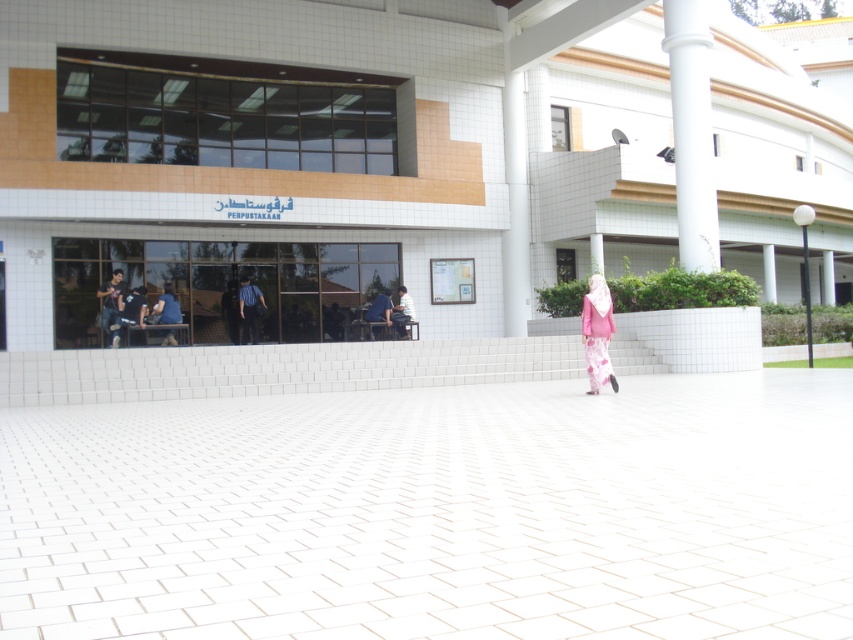
Which is behind, point (686, 92) or point (384, 312)?

The point (384, 312) is more distant.

This screenshot has width=853, height=640. In order to click on white smooth column at right in this screenshot , I will do `click(691, 132)`.

Is point (682, 266) positioned behind point (386, 320)?

No, (682, 266) is closer to viewer.

Where is `white smooth column at right`? The image size is (853, 640). white smooth column at right is located at coordinates (691, 132).

Who is taller, white tile pavement at center or matte black shirt at center?

With more height is matte black shirt at center.

Where is `white tile pavement at center`? The image size is (853, 640). white tile pavement at center is located at coordinates (437, 513).

Which is more to the left, white tile pavement at center or pink satin hijab at center?

white tile pavement at center

Is white tile pavement at center thinner than pink satin hijab at center?

No, white tile pavement at center is not thinner than pink satin hijab at center.

Which is behind, point (161, 586) or point (601, 342)?

The point (601, 342) is more distant.

Identify the location of white tile pavement at center. click(437, 513).